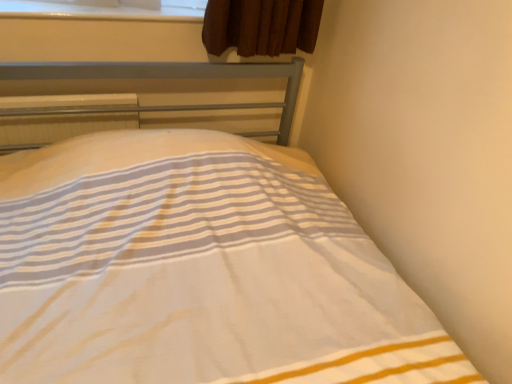
Describe the element at coordinates (96, 12) in the screenshot. The height and width of the screenshot is (384, 512). I see `white plastic window frame at upper center` at that location.

Find the location of a particular element. white plastic window frame at upper center is located at coordinates (96, 12).

What are the coordinates of `white plastic window frame at upper center` in the screenshot? It's located at (96, 12).